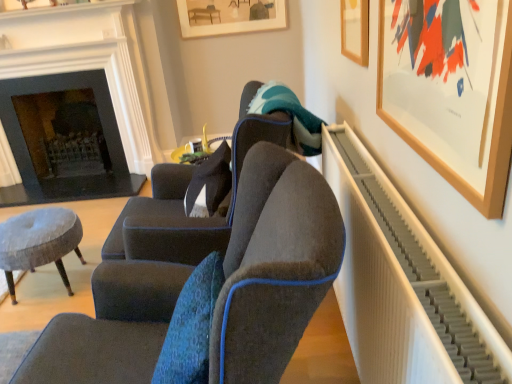
Locate an element on the screen. The image size is (512, 384). vacant location below wooden picture frame at upper right, which appears as the 1th picture frame when viewed from the front (from a real-world perspective) is located at coordinates (418, 210).